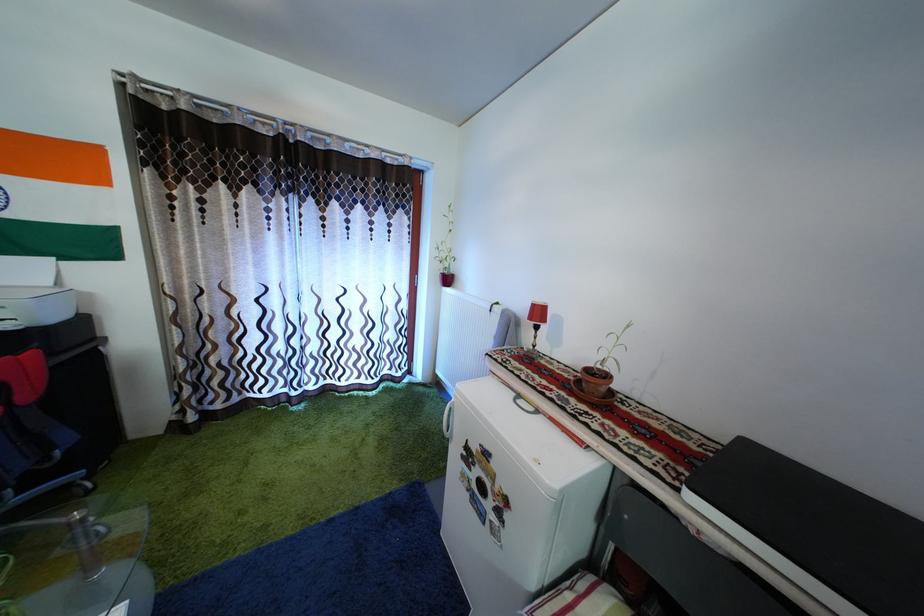
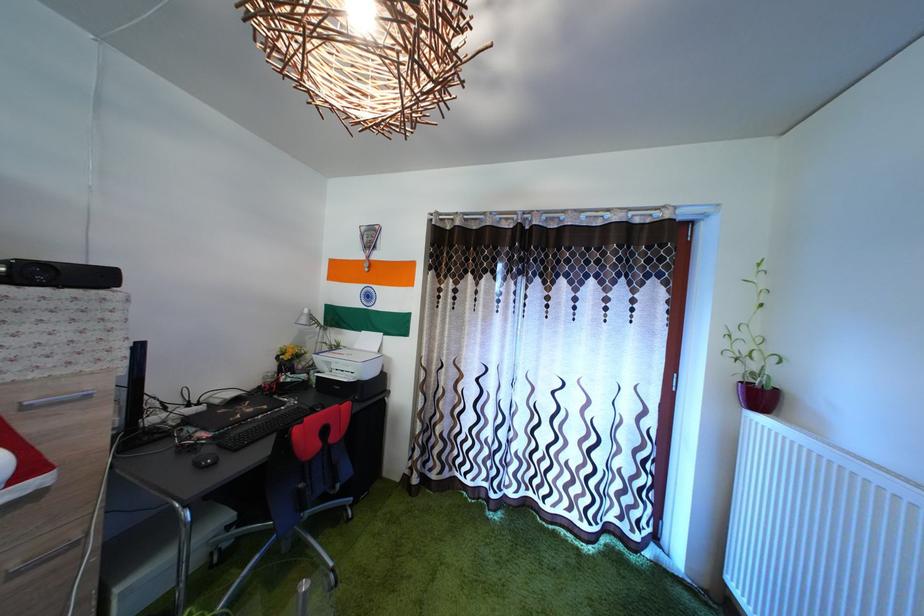
Question: Based on the continuous images, in which direction is the camera rotating? Reply with the corresponding letter.

Choices:
 (A) Left
 (B) Right
 (C) Up
 (D) Down

Answer: (A)